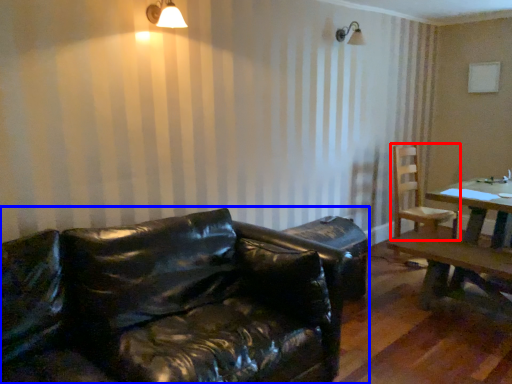
Question: Among these objects, which one is nearest to the camera, chair (highlighted by a red box) or studio couch (highlighted by a blue box)?

Choices:
 (A) chair
 (B) studio couch

Answer: (B)